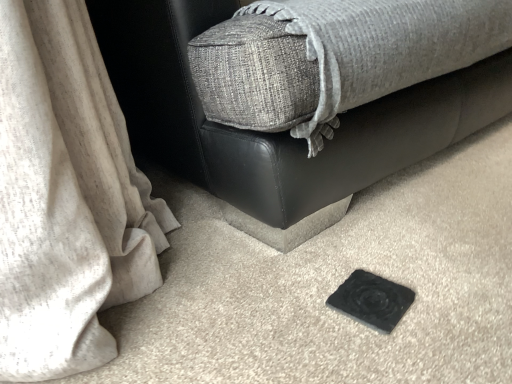
You are a GUI agent. You are given a task and a screenshot of the screen. Output one action in this format:
    pyautogui.click(x=<x>, y=<y>)
    Task: Click on the free space that is to the left of black rubber pad at lower center
    
    Given the screenshot: What is the action you would take?
    pyautogui.click(x=256, y=302)